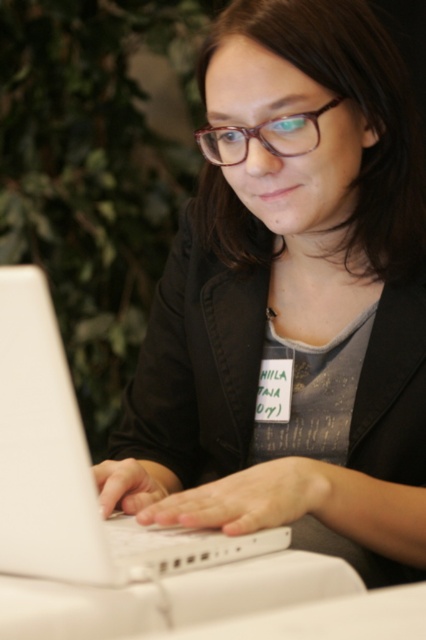
Question: Where is matte black laptop at center located in relation to transparent plastic glasses at center in the image?

Choices:
 (A) above
 (B) below

Answer: (B)

Question: Which object is closer to the camera taking this photo?

Choices:
 (A) transparent plastic glasses at center
 (B) matte black laptop at center

Answer: (B)

Question: Does matte black laptop at center have a lesser width compared to white matte laptop at center?

Choices:
 (A) yes
 (B) no

Answer: (B)

Question: Can you confirm if matte black laptop at center is positioned to the right of white matte laptop at center?

Choices:
 (A) yes
 (B) no

Answer: (A)

Question: Which object appears farthest from the camera in this image?

Choices:
 (A) transparent plastic glasses at center
 (B) matte black laptop at center
 (C) white matte laptop at center

Answer: (A)

Question: Which object appears closest to the camera in this image?

Choices:
 (A) white matte laptop at center
 (B) transparent plastic glasses at center
 (C) matte black laptop at center

Answer: (A)